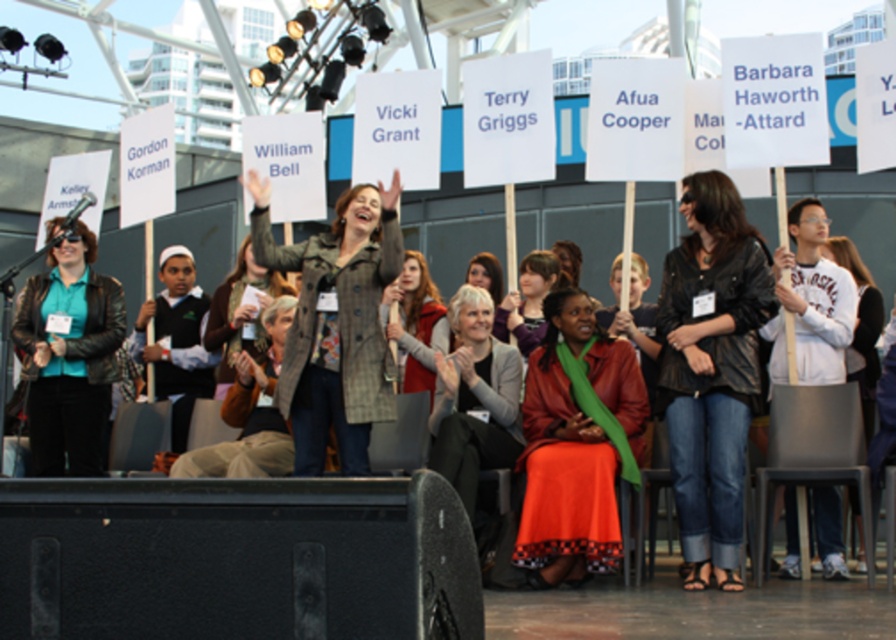
Does matte gray blazer at center have a lesser height compared to matte green scarf at center?

No.

Does matte gray blazer at center appear on the left side of matte green scarf at center?

Indeed, matte gray blazer at center is positioned on the left side of matte green scarf at center.

From the picture: Measure the distance between point (502, 374) and camera.

Point (502, 374) is 13.87 meters away from camera.

You are a GUI agent. You are given a task and a screenshot of the screen. Output one action in this format:
    pyautogui.click(x=<x>, y=<y>)
    Task: Click on the matte gray blazer at center
    The width and height of the screenshot is (896, 640).
    Given the screenshot: What is the action you would take?
    pyautogui.click(x=474, y=397)

Based on the photo, is matte red dress at center to the right of dark blue sweater at center from the viewer's perspective?

Correct, you'll find matte red dress at center to the right of dark blue sweater at center.

Does point (575, 305) come closer to viewer compared to point (179, 424)?

Yes.

Between point (576, 444) and point (196, 285), which one is positioned in front?

Point (576, 444) is in front.

Find the location of a particular element. matte red dress at center is located at coordinates (575, 444).

How distant is leather jacket at center from plaid wool coat at center?

leather jacket at center and plaid wool coat at center are 4.31 meters apart from each other.

Who is positioned more to the left, leather jacket at center or plaid wool coat at center?

plaid wool coat at center is more to the left.

This screenshot has height=640, width=896. What do you see at coordinates (711, 371) in the screenshot? I see `leather jacket at center` at bounding box center [711, 371].

The height and width of the screenshot is (640, 896). I want to click on leather jacket at center, so tap(711, 371).